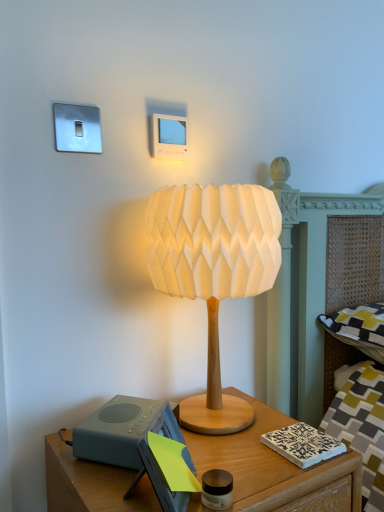
Where is `free point below white paper lampshade at center (from a real-world perspective)`? The width and height of the screenshot is (384, 512). free point below white paper lampshade at center (from a real-world perspective) is located at coordinates (238, 417).